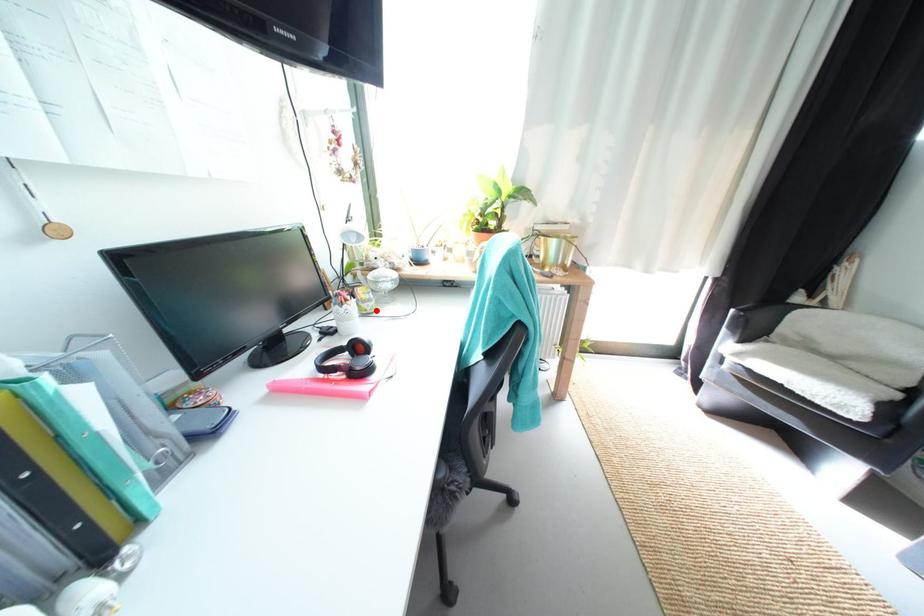
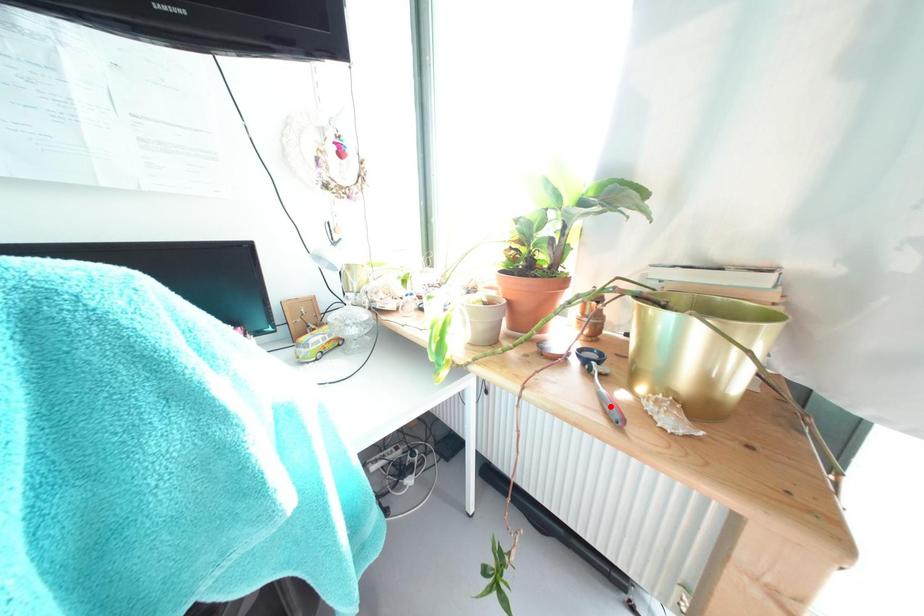
I am providing you with two images of the same scene from different viewpoints. A red point is marked on the first image and another point is marked on the second image. Is the marked point in image1 the same physical position as the marked point in image2?

No